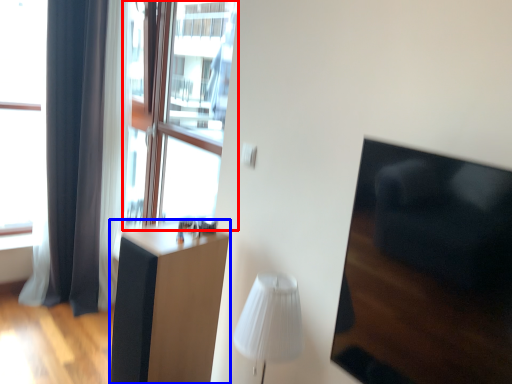
Question: Which point is closer to the camera, window screen (highlighted by a red box) or furniture (highlighted by a blue box)?

Choices:
 (A) window screen
 (B) furniture

Answer: (B)